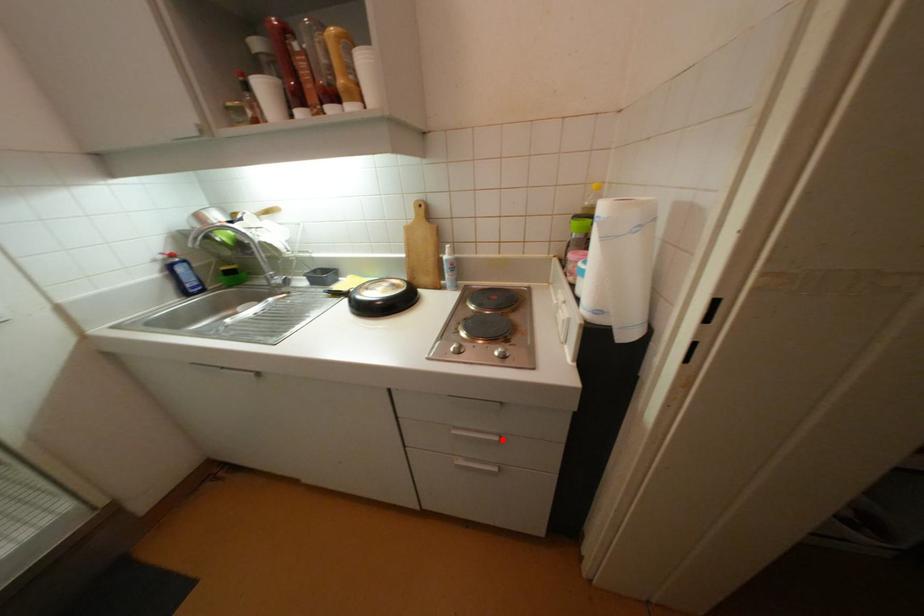
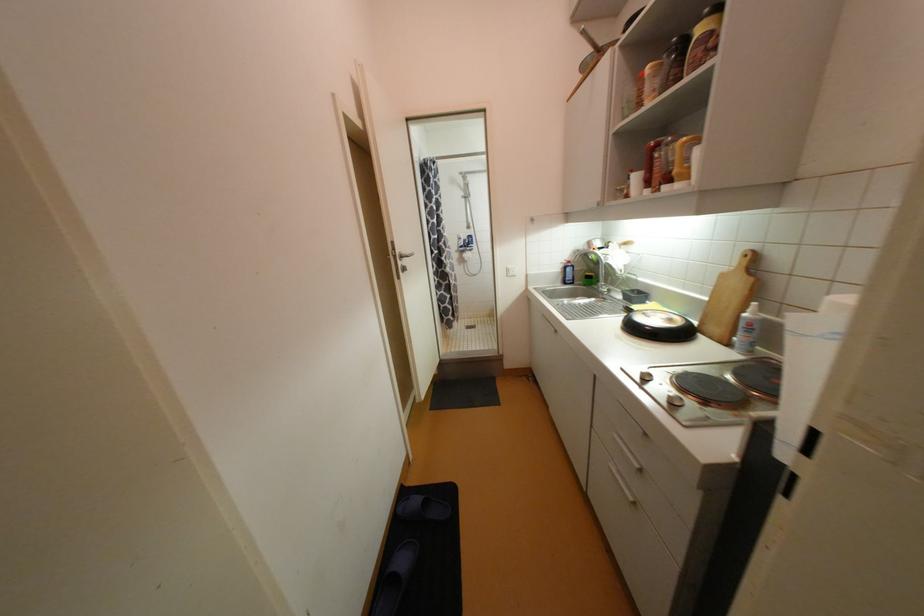
Find the pixel in the second image that matches the highlighted location in the first image.

(641, 467)